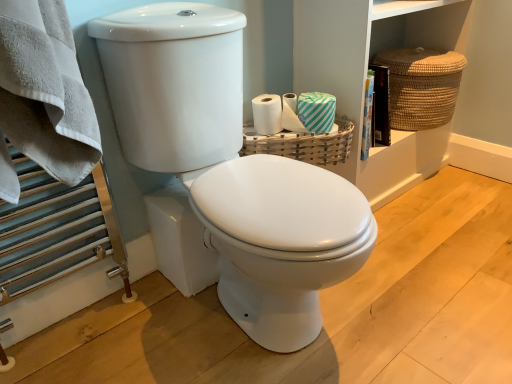
Where is `woven wood basket at upper right, acting as the 1th basket starting from the front`? woven wood basket at upper right, acting as the 1th basket starting from the front is located at coordinates (302, 144).

Measure the distance between teal striped tissue at upper right and camera.

The depth of teal striped tissue at upper right is 1.33 meters.

This screenshot has height=384, width=512. I want to click on brown woven basket at upper right, so click(365, 77).

The height and width of the screenshot is (384, 512). Identify the location of white glossy toilet at center, marked as the second toilet in a front-to-back arrangement. (281, 242).

At what (x,y) coordinates should I click in order to perform the action: click on woven wood basket at upper right, acting as the 1th basket starting from the front. Please return your answer as a coordinate pair (x, y). The width and height of the screenshot is (512, 384). Looking at the image, I should click on (302, 144).

From a real-world perspective, is braided straw basket at upper right, which is the 1th basket from top to bottom, positioned over teal striped tissue at upper right based on gravity?

No.

In the scene shown: Considering the sizes of objects braided straw basket at upper right, which is the 1th basket from top to bottom, and teal striped tissue at upper right in the image provided, who is bigger, braided straw basket at upper right, which is the 1th basket from top to bottom, or teal striped tissue at upper right?

With larger size is braided straw basket at upper right, which is the 1th basket from top to bottom.

Choose the correct answer: Is braided straw basket at upper right, placed as the first basket when sorted from back to front, inside teal striped tissue at upper right or outside it?

braided straw basket at upper right, placed as the first basket when sorted from back to front, is not inside teal striped tissue at upper right, it's outside.

Where is `toilet paper that appears in front of the braided straw basket at upper right, which is the second basket from left to right`? toilet paper that appears in front of the braided straw basket at upper right, which is the second basket from left to right is located at coordinates (316, 111).

Which is behind, braided straw basket at upper right, arranged as the second basket when ordered from the bottom, or brown woven basket at upper right?

braided straw basket at upper right, arranged as the second basket when ordered from the bottom.

Which object is thinner, braided straw basket at upper right, the 2th basket viewed from the front, or brown woven basket at upper right?

With smaller width is brown woven basket at upper right.

From the image's perspective, is braided straw basket at upper right, arranged as the second basket when ordered from the bottom, located above or below brown woven basket at upper right?

braided straw basket at upper right, arranged as the second basket when ordered from the bottom, is above brown woven basket at upper right.

From a real-world perspective, between braided straw basket at upper right, placed as the first basket when sorted from back to front, and brown woven basket at upper right, who is vertically higher?

braided straw basket at upper right, placed as the first basket when sorted from back to front, is physically above.

From a real-world perspective, does woven wood basket at upper right, marked as the 1th basket in a left-to-right arrangement, stand above brown woven basket at upper right?

No, from a real-world perspective, woven wood basket at upper right, marked as the 1th basket in a left-to-right arrangement, is not over brown woven basket at upper right

From the image's perspective, is woven wood basket at upper right, the second basket viewed from the right, beneath brown woven basket at upper right?

Yes.

From the brown woven basket at upper right, count 1st baskets backward and point to it. Please provide its 2D coordinates.

[(302, 144)]

Is woven wood basket at upper right, which is the 2th basket in back-to-front order, further to the viewer compared to brown woven basket at upper right?

Yes, the depth of woven wood basket at upper right, which is the 2th basket in back-to-front order, is greater than that of brown woven basket at upper right.

Which of these two, white glossy toilet at center, positioned as the first toilet in front-to-back order, or braided straw basket at upper right, the 2th basket viewed from the front, is smaller?

braided straw basket at upper right, the 2th basket viewed from the front, is smaller.

Is braided straw basket at upper right, placed as the first basket when sorted from back to front, inside white glossy toilet at center, positioned as the first toilet in front-to-back order?

Actually, braided straw basket at upper right, placed as the first basket when sorted from back to front, is outside white glossy toilet at center, positioned as the first toilet in front-to-back order.

This screenshot has width=512, height=384. I want to click on toilet above the braided straw basket at upper right, which is the second basket from left to right (from a real-world perspective), so click(x=232, y=169).

Looking at this image, considering the relative sizes of white glossy toilet at center, positioned as the first toilet in front-to-back order, and braided straw basket at upper right, which is the second basket from left to right, in the image provided, is white glossy toilet at center, positioned as the first toilet in front-to-back order, thinner than braided straw basket at upper right, which is the second basket from left to right,?

No, white glossy toilet at center, positioned as the first toilet in front-to-back order, is not thinner than braided straw basket at upper right, which is the second basket from left to right.

This screenshot has height=384, width=512. Identify the location of toilet that appears below the white glossy toilet at center, positioned as the first toilet in front-to-back order (from a real-world perspective). (281, 242).

From the image's perspective, is white glossy toilet at center, positioned as the first toilet in front-to-back order, over white glossy toilet at center, marked as the second toilet in a front-to-back arrangement?

Yes.

How many degrees apart are the facing directions of white glossy toilet at center, the second toilet viewed from the back, and white glossy toilet at center, which is the first toilet from back to front?

The facing directions of white glossy toilet at center, the second toilet viewed from the back, and white glossy toilet at center, which is the first toilet from back to front, are 1.35 degrees apart.

Which is more to the left, white glossy toilet at center, positioned as the first toilet in front-to-back order, or white glossy toilet at center, marked as the second toilet in a front-to-back arrangement?

white glossy toilet at center, marked as the second toilet in a front-to-back arrangement.

This screenshot has height=384, width=512. What are the coordinates of `basket below the teal striped tissue at upper right (from the image's perspective)` in the screenshot? It's located at (302, 144).

Which object is further away from the camera, teal striped tissue at upper right or woven wood basket at upper right, the second basket viewed from the right?

woven wood basket at upper right, the second basket viewed from the right, is further away from the camera.

From a real-world perspective, between teal striped tissue at upper right and woven wood basket at upper right, which is the 2th basket in back-to-front order, who is vertically lower?

From a 3D spatial view, woven wood basket at upper right, which is the 2th basket in back-to-front order, is below.

From the image's perspective, which object appears higher, white glossy toilet at center, marked as the second toilet in a front-to-back arrangement, or braided straw basket at upper right, placed as the first basket when sorted from back to front?

From the image's view, braided straw basket at upper right, placed as the first basket when sorted from back to front, is above.

Who is more distant, white glossy toilet at center, which is the first toilet from back to front, or braided straw basket at upper right, which is the second basket from left to right?

braided straw basket at upper right, which is the second basket from left to right, is more distant.

Is white glossy toilet at center, which is the first toilet from back to front, touching braided straw basket at upper right, which is the second basket from left to right?

They are not placed beside each other.

You are a GUI agent. You are given a task and a screenshot of the screen. Output one action in this format:
    pyautogui.click(x=<x>, y=<y>)
    Task: Click on the 2nd basket behind the teal striped tissue at upper right
    The image size is (512, 384).
    Given the screenshot: What is the action you would take?
    pyautogui.click(x=421, y=86)

At what (x,y) coordinates should I click in order to perform the action: click on bookshelf that appears in front of the braided straw basket at upper right, the 2th basket viewed from the front. Please return your answer as a coordinate pair (x, y). Looking at the image, I should click on (365, 77).

Looking at the image, which one is located closer to brown woven basket at upper right, white glossy toilet at center, which is the first toilet from back to front, or white glossy toilet at center, the second toilet viewed from the back?

white glossy toilet at center, the second toilet viewed from the back, is closer to brown woven basket at upper right.

Considering their positions, is braided straw basket at upper right, the 2th basket viewed from the front, positioned closer to white glossy toilet at center, which is the first toilet from back to front, than woven wood basket at upper right, which is the 2th basket in back-to-front order?

woven wood basket at upper right, which is the 2th basket in back-to-front order, lies closer to white glossy toilet at center, which is the first toilet from back to front, than the other object.

Estimate the real-world distances between objects in this image. Which object is closer to teal striped tissue at upper right, white glossy toilet at center, positioned as the first toilet in front-to-back order, or white glossy toilet at center, which is the first toilet from back to front?

The object closer to teal striped tissue at upper right is white glossy toilet at center, positioned as the first toilet in front-to-back order.

Considering their positions, is woven wood basket at upper right, the 2th basket when ordered from top to bottom, positioned further to white glossy toilet at center, positioned as the first toilet in front-to-back order, than brown woven basket at upper right?

Based on the image, brown woven basket at upper right appears to be further to white glossy toilet at center, positioned as the first toilet in front-to-back order.

Estimate the real-world distances between objects in this image. Which object is further from white glossy toilet at center, which is the first toilet from back to front, woven wood basket at upper right, the second basket viewed from the right, or teal striped tissue at upper right?

teal striped tissue at upper right is further to white glossy toilet at center, which is the first toilet from back to front.

From the image, which object appears to be nearer to white glossy toilet at center, marked as the second toilet in a front-to-back arrangement, teal striped tissue at upper right or woven wood basket at upper right, marked as the 1th basket in a bottom-to-top arrangement?

Based on the image, woven wood basket at upper right, marked as the 1th basket in a bottom-to-top arrangement, appears to be nearer to white glossy toilet at center, marked as the second toilet in a front-to-back arrangement.

Based on their spatial positions, is white glossy toilet at center, which is the first toilet from back to front, or braided straw basket at upper right, which is the second basket from left to right, closer to brown woven basket at upper right?

braided straw basket at upper right, which is the second basket from left to right, lies closer to brown woven basket at upper right than the other object.

Based on their spatial positions, is white glossy toilet at center, which is the first toilet from back to front, or woven wood basket at upper right, marked as the 1th basket in a left-to-right arrangement, closer to white glossy toilet at center, the second toilet viewed from the back?

The object closer to white glossy toilet at center, the second toilet viewed from the back, is white glossy toilet at center, which is the first toilet from back to front.

This screenshot has width=512, height=384. Identify the location of bookshelf positioned between white glossy toilet at center, the second toilet viewed from the back, and teal striped tissue at upper right from near to far. (365, 77).

Where is `basket between white glossy toilet at center, which is the first toilet from back to front, and brown woven basket at upper right, in the horizontal direction`? This screenshot has width=512, height=384. basket between white glossy toilet at center, which is the first toilet from back to front, and brown woven basket at upper right, in the horizontal direction is located at coordinates (302, 144).

This screenshot has width=512, height=384. What are the coordinates of `toilet paper between white glossy toilet at center, which is the first toilet from back to front, and braided straw basket at upper right, arranged as the second basket when ordered from the bottom, in the horizontal direction` in the screenshot? It's located at (316, 111).

At what (x,y) coordinates should I click in order to perform the action: click on toilet paper between white glossy toilet at center, positioned as the first toilet in front-to-back order, and woven wood basket at upper right, acting as the 1th basket starting from the front, along the z-axis. Please return your answer as a coordinate pair (x, y). Looking at the image, I should click on tap(316, 111).